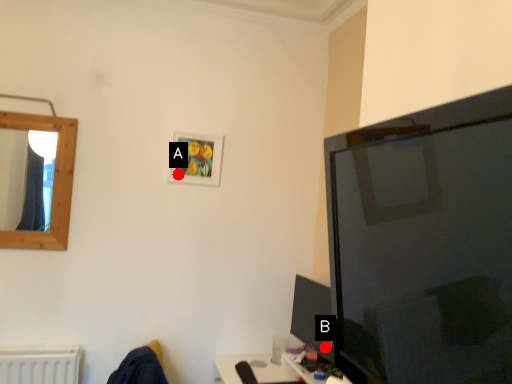
Question: Two points are circled on the image, labeled by A and B beside each circle. Which point appears farthest from the camera in this image?

Choices:
 (A) A is further
 (B) B is further

Answer: (A)